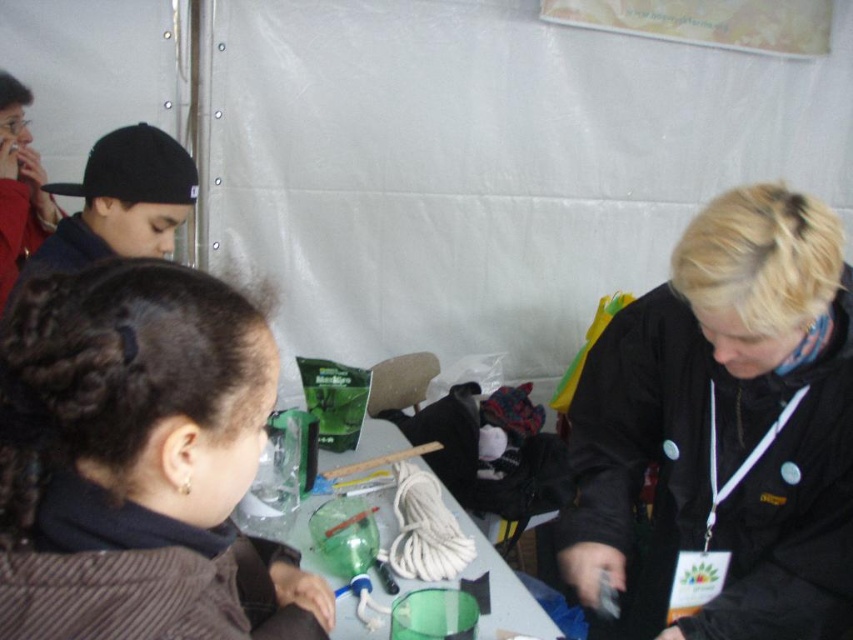
Question: Does black matte cap at upper left appear under translucent plastic table at center?

Choices:
 (A) yes
 (B) no

Answer: (B)

Question: Which is nearer to the translucent plastic table at center?

Choices:
 (A) matte red jacket at upper left
 (B) dark brown hair at upper left

Answer: (B)

Question: Which object appears closest to the camera in this image?

Choices:
 (A) translucent plastic table at center
 (B) matte red jacket at upper left
 (C) black matte cap at upper left

Answer: (A)

Question: Estimate the real-world distances between objects in this image. Which object is farther from the black matte cap at upper left?

Choices:
 (A) black matte jacket at upper right
 (B) dark brown hair at upper left
 (C) translucent plastic table at center
 (D) matte red jacket at upper left

Answer: (A)

Question: Does matte red jacket at upper left have a greater width compared to translucent plastic table at center?

Choices:
 (A) no
 (B) yes

Answer: (A)

Question: Does black matte cap at upper left lie behind translucent plastic table at center?

Choices:
 (A) no
 (B) yes

Answer: (B)